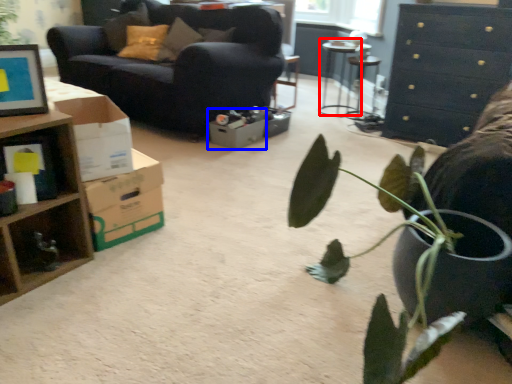
Question: Which point is further to the camera, table (highlighted by a red box) or cardboard box (highlighted by a blue box)?

Choices:
 (A) table
 (B) cardboard box

Answer: (A)